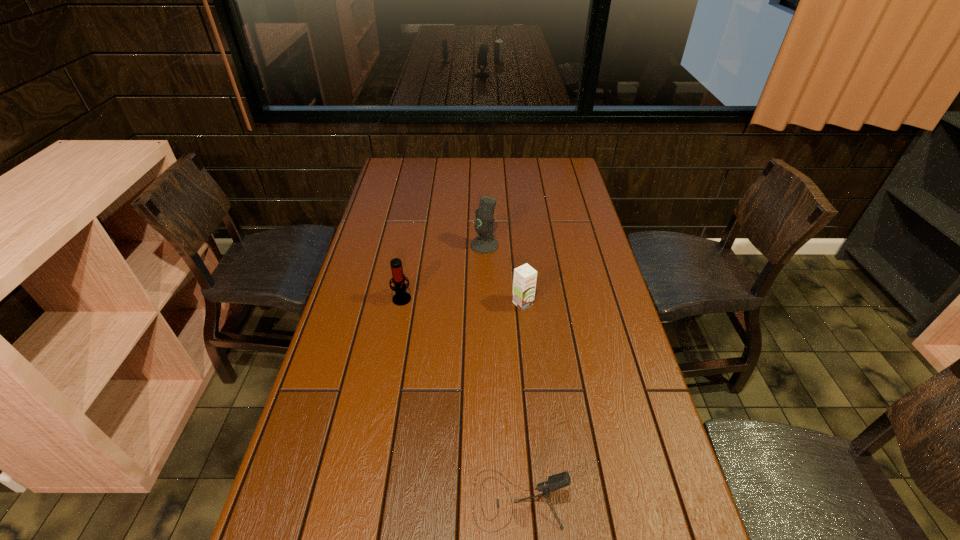
Identify which microphone is the second closest to the chocolate milk. Please provide its 2D coordinates. Your answer should be formatted as a tuple, i.e. [(x, y)], where the tuple contains the x and y coordinates of a point satisfying the conditions above.

[(401, 298)]

Choose which microphone is the nearest neighbor to the farthest microphone. Please provide its 2D coordinates. Your answer should be formatted as a tuple, i.e. [(x, y)], where the tuple contains the x and y coordinates of a point satisfying the conditions above.

[(401, 298)]

At what (x,y) coordinates should I click in order to perform the action: click on vacant space that satisfies the following two spatial constraints: 1. on the front side of the chocolate milk; 2. on the left side of the second nearest microphone. Please return your answer as a coordinate pair (x, y). This screenshot has height=540, width=960. Looking at the image, I should click on (401, 303).

This screenshot has width=960, height=540. I want to click on vacant space that satisfies the following two spatial constraints: 1. on the front side of the chocolate milk; 2. on the stand of the nearest object, so click(542, 500).